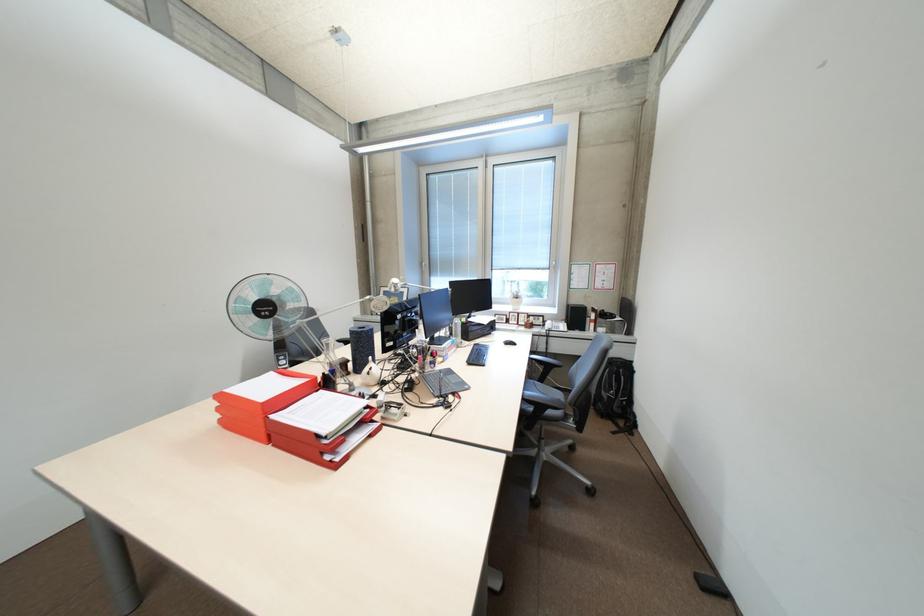
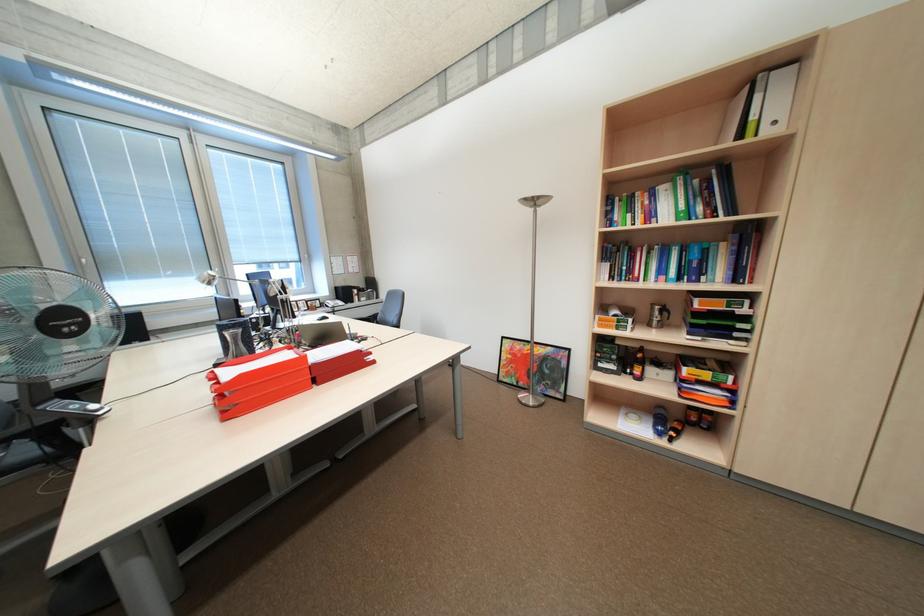
Question: I am providing you with two images of the same scene from different viewpoints. After the viewpoint changes to image2, which objects are now occluded?

Choices:
 (A) white binder
 (B) blue water bottle
 (C) red decorative object
 (D) black backpack

Answer: (D)